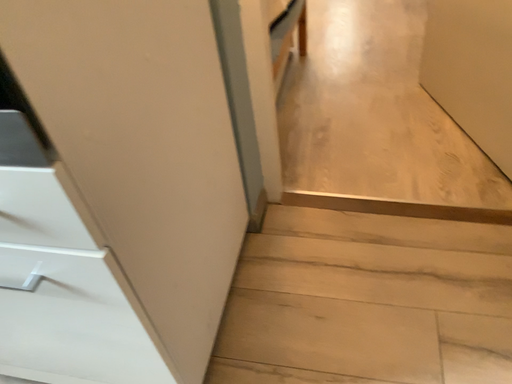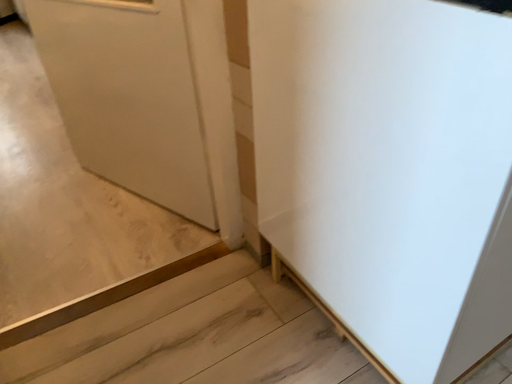
Question: Which way did the camera rotate in the video?

Choices:
 (A) rotated upward
 (B) rotated downward

Answer: (A)